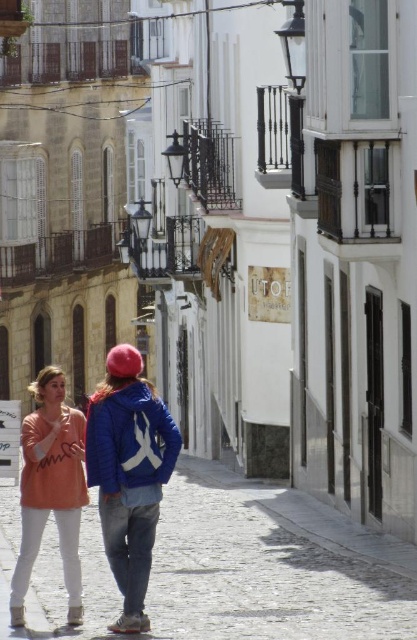
Looking at this image, is blue denim jacket at center thinner than matte peach sweater at center?

Indeed, blue denim jacket at center has a lesser width compared to matte peach sweater at center.

Between blue denim jacket at center and matte peach sweater at center, which one has less height?

matte peach sweater at center is shorter.

Is point (20, 554) closer to viewer compared to point (25, 554)?

That is False.

Identify the location of blue denim jacket at center. (127, 472).

Is cobblestone pavement at lower center in front of matte peach sweater at center?

Yes, cobblestone pavement at lower center is closer to the viewer.

Does cobblestone pavement at lower center have a greater width compared to matte peach sweater at center?

Correct, the width of cobblestone pavement at lower center exceeds that of matte peach sweater at center.

Measure the distance between point (308, 614) and camera.

A distance of 34.19 meters exists between point (308, 614) and camera.

Where is `cobblestone pavement at lower center`? The height and width of the screenshot is (640, 417). cobblestone pavement at lower center is located at coordinates (271, 564).

Can you confirm if cobblestone pavement at lower center is smaller than blue fleece sweatshirt at center?

No, cobblestone pavement at lower center is not smaller than blue fleece sweatshirt at center.

Who is shorter, cobblestone pavement at lower center or blue fleece sweatshirt at center?

cobblestone pavement at lower center

Between point (196, 483) and point (108, 472), which one is positioned behind?

Positioned behind is point (196, 483).

The image size is (417, 640). I want to click on cobblestone pavement at lower center, so click(271, 564).